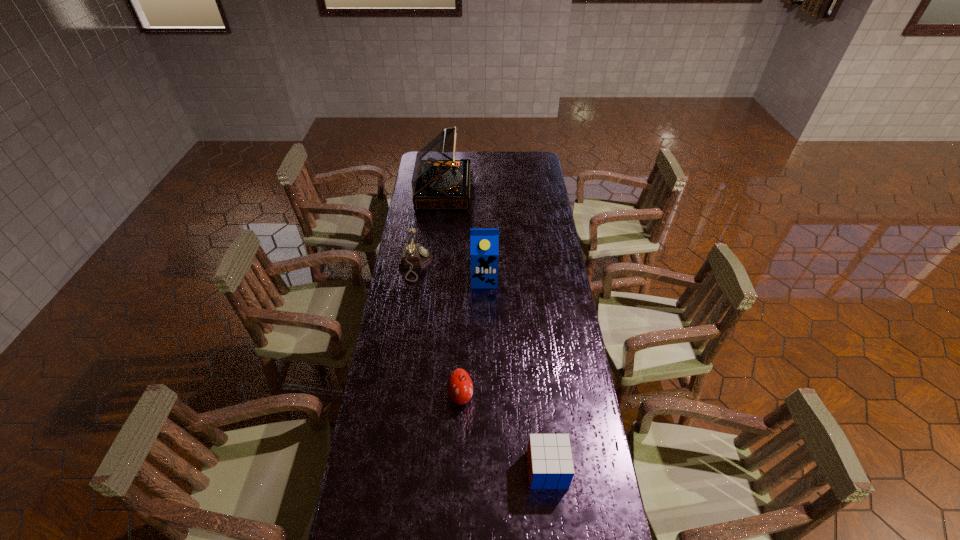
Image resolution: width=960 pixels, height=540 pixels. In order to click on record player in this screenshot , I will do `click(439, 181)`.

Find the location of `carton`. carton is located at coordinates (484, 243).

The width and height of the screenshot is (960, 540). Find the location of `telephone`. telephone is located at coordinates (414, 255).

You are a GUI agent. You are given a task and a screenshot of the screen. Output one action in this format:
    pyautogui.click(x=<x>, y=<y>)
    Task: Click on the apple
    Image resolution: width=960 pixels, height=540 pixels.
    Given the screenshot: What is the action you would take?
    pyautogui.click(x=459, y=386)

This screenshot has height=540, width=960. Identify the location of the nearest object. (550, 466).

Identify the location of cube. (550, 466).

At what (x,y) coordinates should I click in order to perform the action: click on vacant space located on the front-facing side of the farthest object. Please return your answer as a coordinate pair (x, y). The height and width of the screenshot is (540, 960). Looking at the image, I should click on (492, 191).

This screenshot has height=540, width=960. Find the location of `vacant space located with the cap open on the carton`. vacant space located with the cap open on the carton is located at coordinates (485, 318).

At what (x,y) coordinates should I click in order to perform the action: click on vacant space located 0.360m on the dial of the telephone. Please return your answer as a coordinate pair (x, y). Looking at the image, I should click on (514, 264).

Locate an element on the screen. This screenshot has height=540, width=960. vacant space located on the left of the second nearest object is located at coordinates (415, 395).